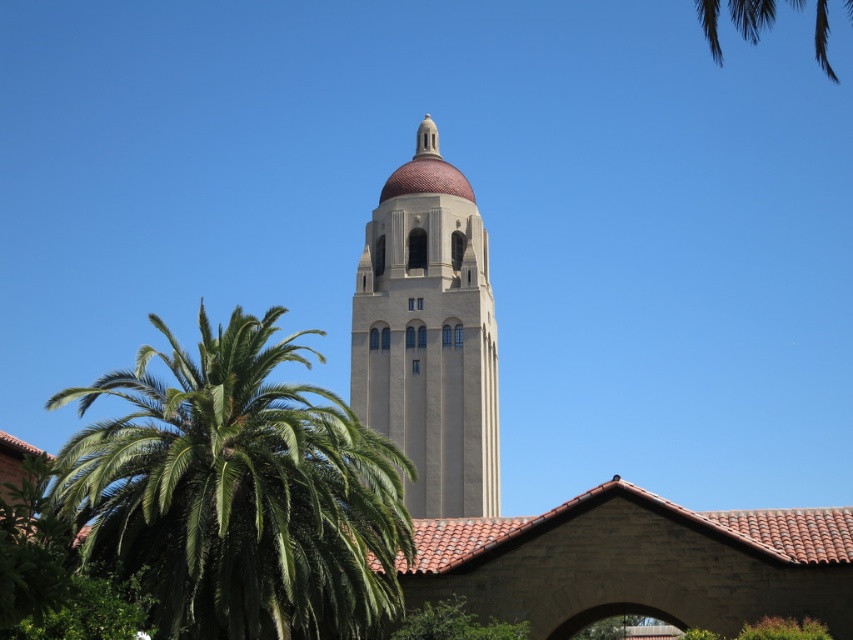
In the scene shown: You are standing in front of the tower and want to take a photo that includes both the green leafy palm at left and the green leafy tree at lower center. Which of the two should you position closer to the camera to ensure both fit in the frame?

The green leafy palm at left is larger than the green leafy tree at lower center, so you should position the green leafy palm at left closer to the camera to ensure both fit in the frame.

You are standing in the park and see the beige stone bell tower at center and the green leafy tree at lower center. Which object appears bigger to you?

The beige stone bell tower at center appears bigger than the green leafy tree at lower center because it is larger in size.